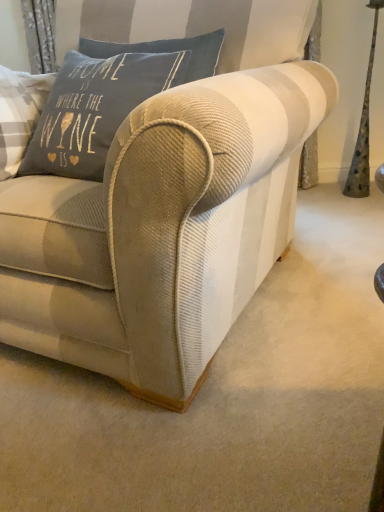
Question: Is beige corduroy couch at center surrounding matte gray cushion at upper left?

Choices:
 (A) no
 (B) yes

Answer: (B)

Question: Can you confirm if beige corduroy couch at center is thinner than matte gray cushion at upper left?

Choices:
 (A) yes
 (B) no

Answer: (B)

Question: From the image's perspective, is beige corduroy couch at center under matte gray cushion at upper left?

Choices:
 (A) no
 (B) yes

Answer: (B)

Question: Does beige corduroy couch at center come in front of matte gray cushion at upper left?

Choices:
 (A) no
 (B) yes

Answer: (B)

Question: Can you confirm if beige corduroy couch at center is bigger than matte gray cushion at upper left?

Choices:
 (A) no
 (B) yes

Answer: (B)

Question: From a real-world perspective, is beige corduroy couch at center positioned under matte gray cushion at upper left based on gravity?

Choices:
 (A) yes
 (B) no

Answer: (A)

Question: Does matte gray cushion at upper left have a lesser width compared to beige corduroy couch at center?

Choices:
 (A) yes
 (B) no

Answer: (A)

Question: Considering the relative sizes of matte gray cushion at upper left and beige corduroy couch at center in the image provided, is matte gray cushion at upper left smaller than beige corduroy couch at center?

Choices:
 (A) no
 (B) yes

Answer: (B)

Question: Is matte gray cushion at upper left at the left side of beige corduroy couch at center?

Choices:
 (A) yes
 (B) no

Answer: (A)

Question: Does matte gray cushion at upper left have a greater height compared to beige corduroy couch at center?

Choices:
 (A) no
 (B) yes

Answer: (A)

Question: From the image's perspective, is matte gray cushion at upper left beneath beige corduroy couch at center?

Choices:
 (A) yes
 (B) no

Answer: (B)

Question: From a real-world perspective, is matte gray cushion at upper left under beige corduroy couch at center?

Choices:
 (A) yes
 (B) no

Answer: (B)

Question: From a real-world perspective, relative to matte gray cushion at upper left, is beige corduroy couch at center vertically above or below?

Choices:
 (A) below
 (B) above

Answer: (A)